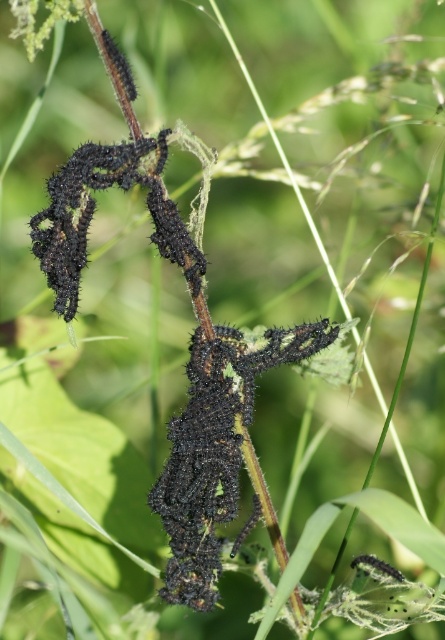
Question: Does black fuzzy caterpillar at center have a greater width compared to fuzzy black caterpillar at left?

Choices:
 (A) yes
 (B) no

Answer: (A)

Question: Estimate the real-world distances between objects in this image. Which object is closer to the fuzzy black caterpillar at left?

Choices:
 (A) black fuzzy caterpillar at upper left
 (B) black fuzzy caterpillar at center

Answer: (A)

Question: Is fuzzy black caterpillar at left positioned behind black fuzzy caterpillar at upper left?

Choices:
 (A) yes
 (B) no

Answer: (B)

Question: Estimate the real-world distances between objects in this image. Which object is farther from the fuzzy black caterpillar at left?

Choices:
 (A) black fuzzy caterpillar at center
 (B) black fuzzy caterpillar at upper left

Answer: (A)

Question: Does black fuzzy caterpillar at center have a smaller size compared to black fuzzy caterpillar at upper left?

Choices:
 (A) yes
 (B) no

Answer: (B)

Question: Which object is farther from the camera taking this photo?

Choices:
 (A) black fuzzy caterpillar at center
 (B) fuzzy black caterpillar at left

Answer: (A)